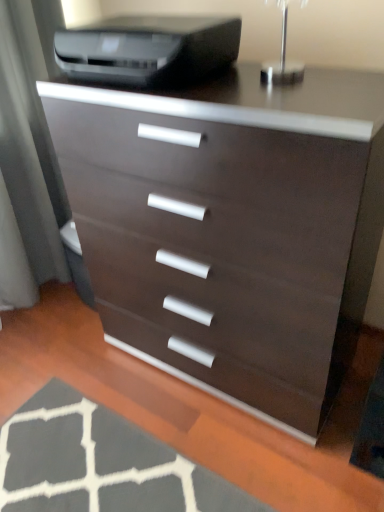
Question: Is dark gray textured rug at lower left positioned behind matte black printer at upper center?

Choices:
 (A) no
 (B) yes

Answer: (A)

Question: From the image's perspective, does dark gray textured rug at lower left appear higher than matte black printer at upper center?

Choices:
 (A) no
 (B) yes

Answer: (A)

Question: Considering the relative positions of dark gray textured rug at lower left and matte black printer at upper center in the image provided, is dark gray textured rug at lower left to the left of matte black printer at upper center from the viewer's perspective?

Choices:
 (A) yes
 (B) no

Answer: (A)

Question: Could you tell me if dark gray textured rug at lower left is turned towards matte black printer at upper center?

Choices:
 (A) no
 (B) yes

Answer: (A)

Question: Are dark gray textured rug at lower left and matte black printer at upper center located far from each other?

Choices:
 (A) no
 (B) yes

Answer: (B)

Question: Is matte brown chest of drawers at center taller or shorter than matte gray screen door at left?

Choices:
 (A) short
 (B) tall

Answer: (A)

Question: Looking at the image, does matte brown chest of drawers at center seem bigger or smaller compared to matte gray screen door at left?

Choices:
 (A) small
 (B) big

Answer: (B)

Question: Is point [258, 356] positioned closer to the camera than point [21, 0]?

Choices:
 (A) farther
 (B) closer

Answer: (B)

Question: Looking at their shapes, would you say matte brown chest of drawers at center is wider or thinner than matte gray screen door at left?

Choices:
 (A) wide
 (B) thin

Answer: (A)

Question: Is matte black printer at upper center in front of or behind matte brown chest of drawers at center in the image?

Choices:
 (A) front
 (B) behind

Answer: (B)

Question: Is matte black printer at upper center bigger or smaller than matte brown chest of drawers at center?

Choices:
 (A) big
 (B) small

Answer: (B)

Question: Considering the positions of matte black printer at upper center and matte brown chest of drawers at center in the image, is matte black printer at upper center taller or shorter than matte brown chest of drawers at center?

Choices:
 (A) short
 (B) tall

Answer: (A)

Question: Based on their positions, is matte black printer at upper center located to the left or right of matte brown chest of drawers at center?

Choices:
 (A) right
 (B) left

Answer: (B)

Question: Is matte gray screen door at left to the left or to the right of matte brown chest of drawers at center in the image?

Choices:
 (A) right
 (B) left

Answer: (B)

Question: In terms of width, does matte gray screen door at left look wider or thinner when compared to matte brown chest of drawers at center?

Choices:
 (A) thin
 (B) wide

Answer: (A)